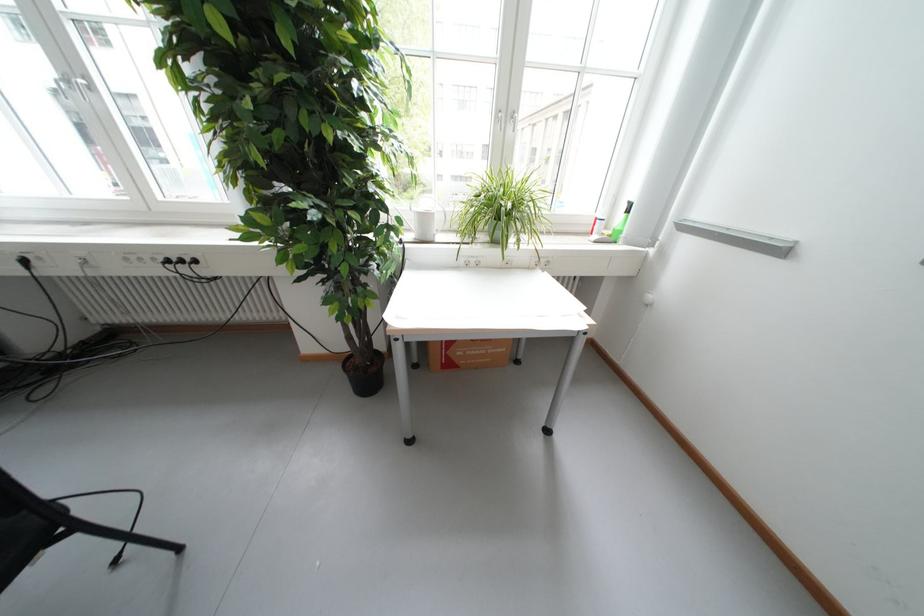
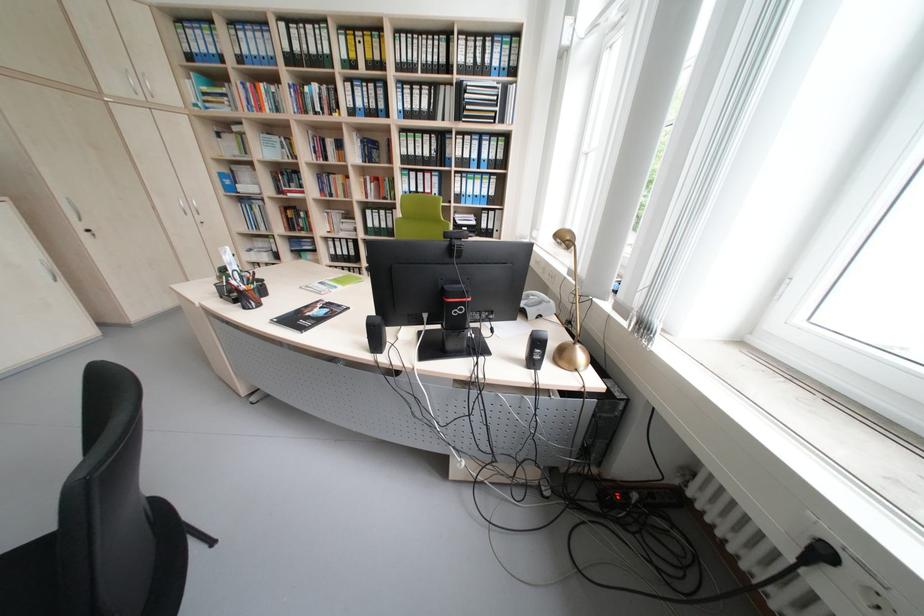
Find the pixel in the second image that matches point 34,262 in the first image.

(833, 554)